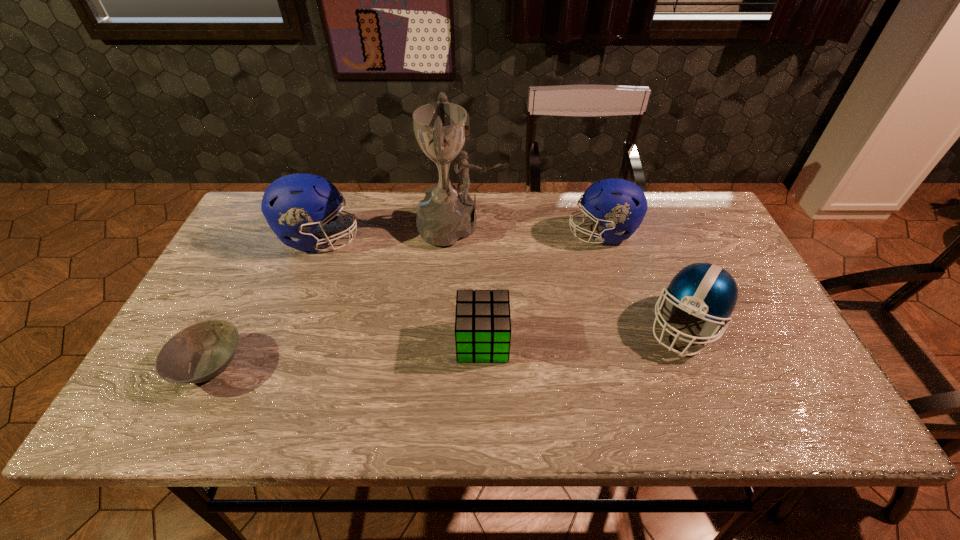
In the image, there is a desktop. At what (x,y) coordinates should I click in order to perform the action: click on free space at the right edge. Please return your answer as a coordinate pair (x, y). The image size is (960, 540). Looking at the image, I should click on (686, 262).

Find the location of `free space at the far left corner of the desktop`. free space at the far left corner of the desktop is located at coordinates (263, 240).

The width and height of the screenshot is (960, 540). In order to click on vacant space at the far right corner in this screenshot , I will do `click(660, 207)`.

Locate an element on the screen. The width and height of the screenshot is (960, 540). free spot between the shortest object and the nearest football helmet is located at coordinates (447, 345).

You are a GUI agent. You are given a task and a screenshot of the screen. Output one action in this format:
    pyautogui.click(x=<x>, y=<y>)
    Task: Click on the free spot between the leftmost football helmet and the shortest object
    
    Given the screenshot: What is the action you would take?
    pyautogui.click(x=264, y=301)

Where is `unoccupied area between the leftmost football helmet and the shortest object`? unoccupied area between the leftmost football helmet and the shortest object is located at coordinates (264, 301).

The width and height of the screenshot is (960, 540). I want to click on empty space between the fifth tallest object and the nearest football helmet, so click(x=584, y=334).

Locate an element on the screen. vacant space that's between the leftmost football helmet and the nearest football helmet is located at coordinates (502, 282).

Select which object is the third closest to the nearest football helmet. Please provide its 2D coordinates. Your answer should be formatted as a tuple, i.e. [(x, y)], where the tuple contains the x and y coordinates of a point satisfying the conditions above.

[(447, 213)]

Select which object is the third closest to the nearest football helmet. Please provide its 2D coordinates. Your answer should be formatted as a tuple, i.e. [(x, y)], where the tuple contains the x and y coordinates of a point satisfying the conditions above.

[(447, 213)]